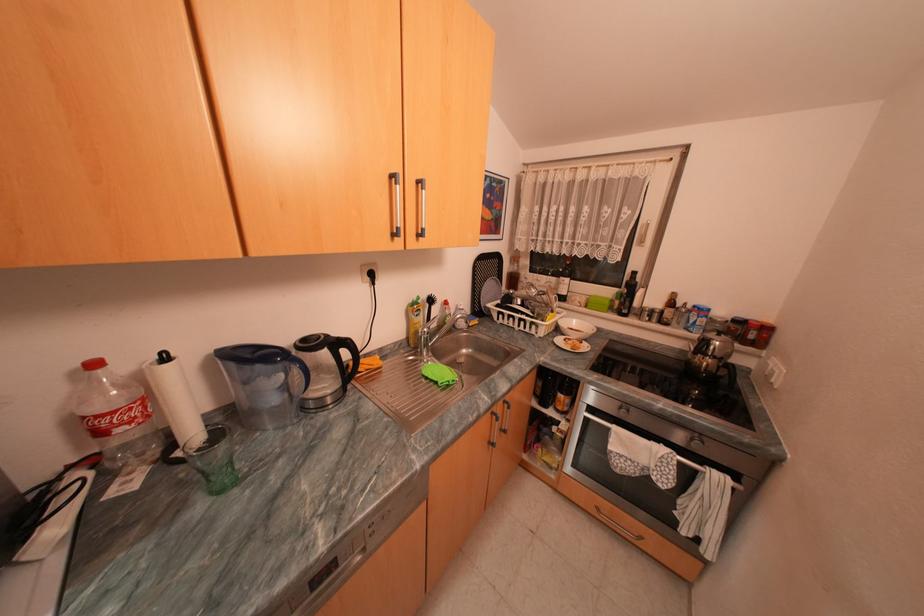
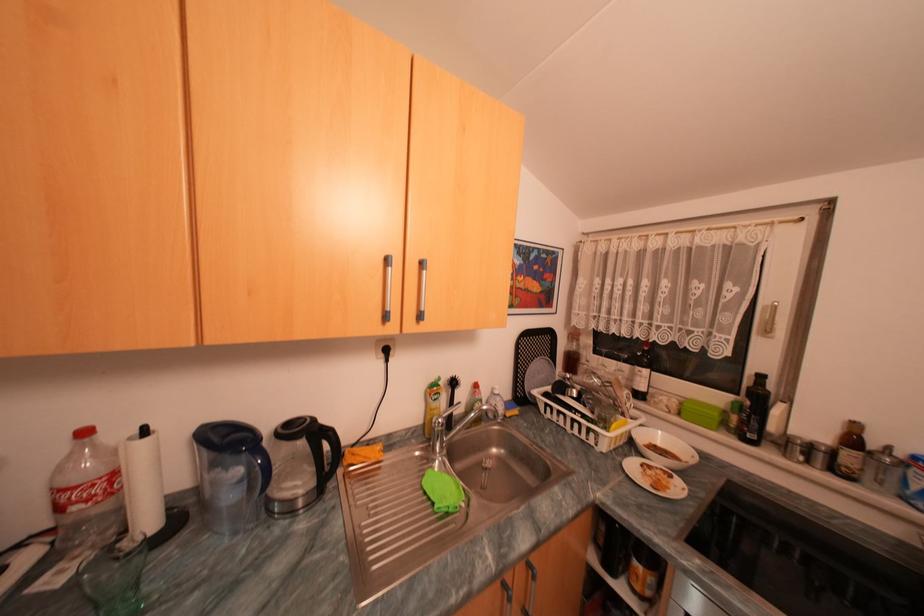
The images are taken continuously from a first-person perspective. In which direction are you moving?

The cameraman walked toward right, forward.